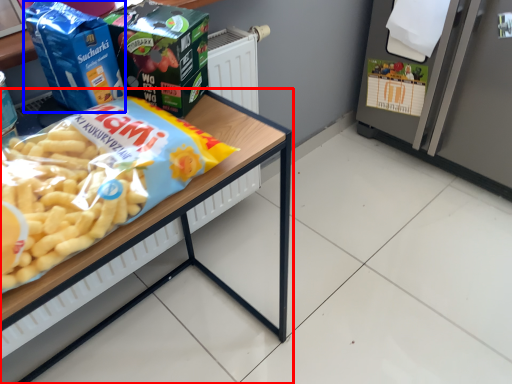
Question: Which point is closer to the camera, table (highlighted by a red box) or product (highlighted by a blue box)?

Choices:
 (A) table
 (B) product

Answer: (A)